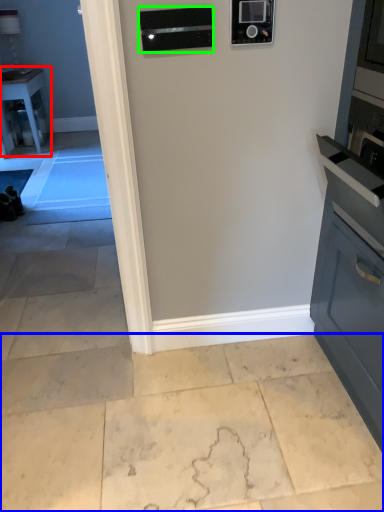
Question: Based on their relative distances, which object is farther from table (highlighted by a red box)? Choose from concrete (highlighted by a blue box) and appliance (highlighted by a green box).

Choices:
 (A) concrete
 (B) appliance

Answer: (A)